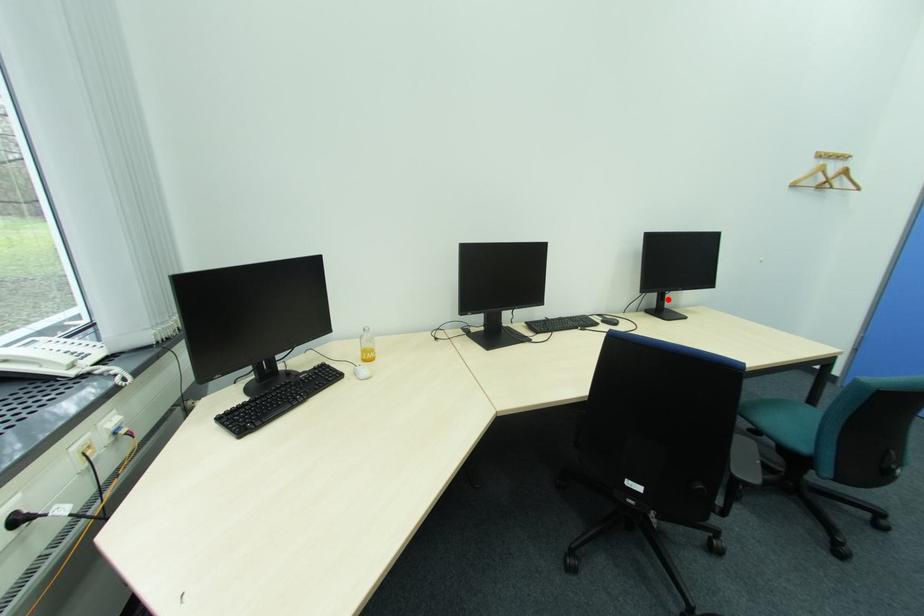
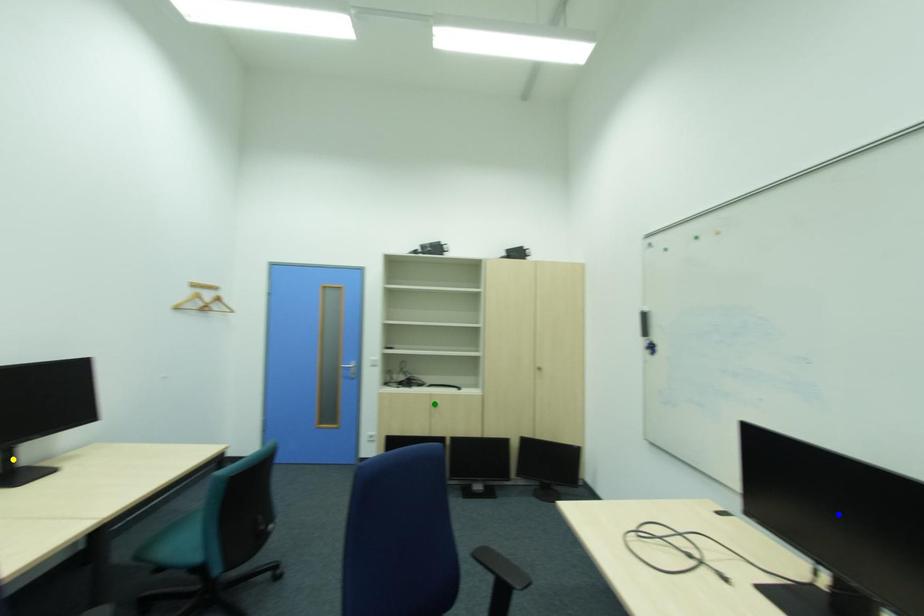
Question: I am providing you with two images of the same scene from different viewpoints. A red point is marked on the first image. You are given multiple points on the second image. Which spot in image 2 lines up with the point in image 1?

Choices:
 (A) yellow point
 (B) green point
 (C) blue point

Answer: (A)